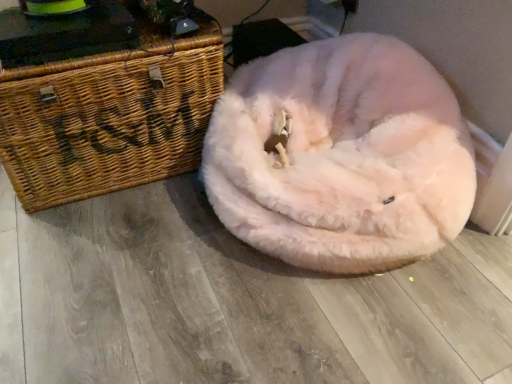
Question: In terms of size, does fluffy pink dog bed at center appear bigger or smaller than woven wood chest at left?

Choices:
 (A) small
 (B) big

Answer: (B)

Question: Is fluffy pink dog bed at center spatially inside woven wood chest at left, or outside of it?

Choices:
 (A) inside
 (B) outside

Answer: (B)

Question: From a real-world perspective, is fluffy pink dog bed at center above or below woven wood chest at left?

Choices:
 (A) below
 (B) above

Answer: (A)

Question: Is woven wood chest at left taller or shorter than fluffy pink dog bed at center?

Choices:
 (A) short
 (B) tall

Answer: (B)

Question: From a real-world perspective, is woven wood chest at left positioned above or below fluffy pink dog bed at center?

Choices:
 (A) above
 (B) below

Answer: (A)

Question: Relative to fluffy pink dog bed at center, is woven wood chest at left in front or behind?

Choices:
 (A) front
 (B) behind

Answer: (B)

Question: Is point (219, 86) closer or farther from the camera than point (413, 122)?

Choices:
 (A) closer
 (B) farther

Answer: (B)